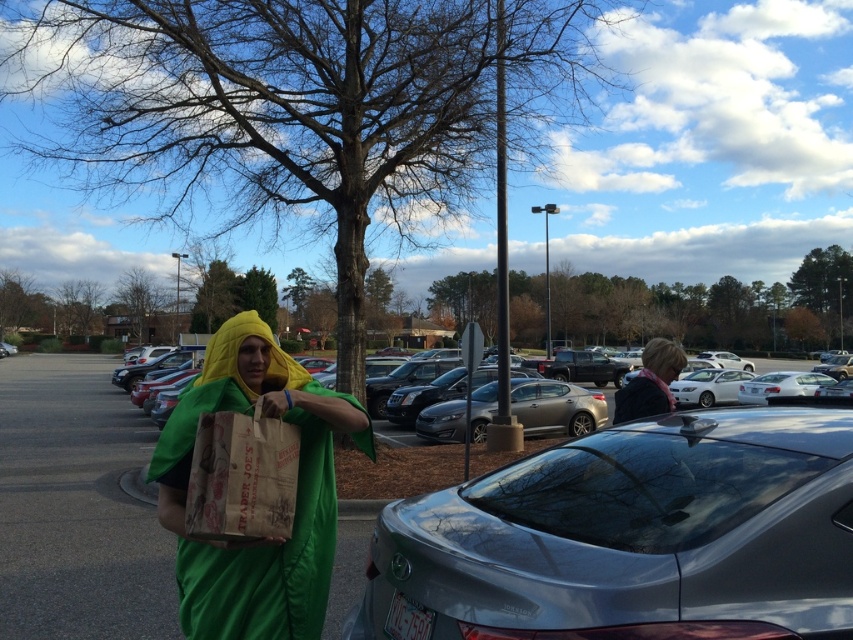
You are a delivery person who needs to park your 1.5 meter wide delivery van between the metallic silver sedan at center and the matte green costume at center. Can you fit your van there?

The metallic silver sedan at center is wider than the matte green costume at center. Therefore, the space between them may not be wide enough for your 1.5 meter wide delivery van. You should check the exact width difference before deciding to park there.

You are standing in the parking lot and see the metallic silver car at center and the matte black jacket at upper right. Which object is located more to the left?

The metallic silver car at center is positioned on the left side of matte black jacket at upper right, so it is more to the left.